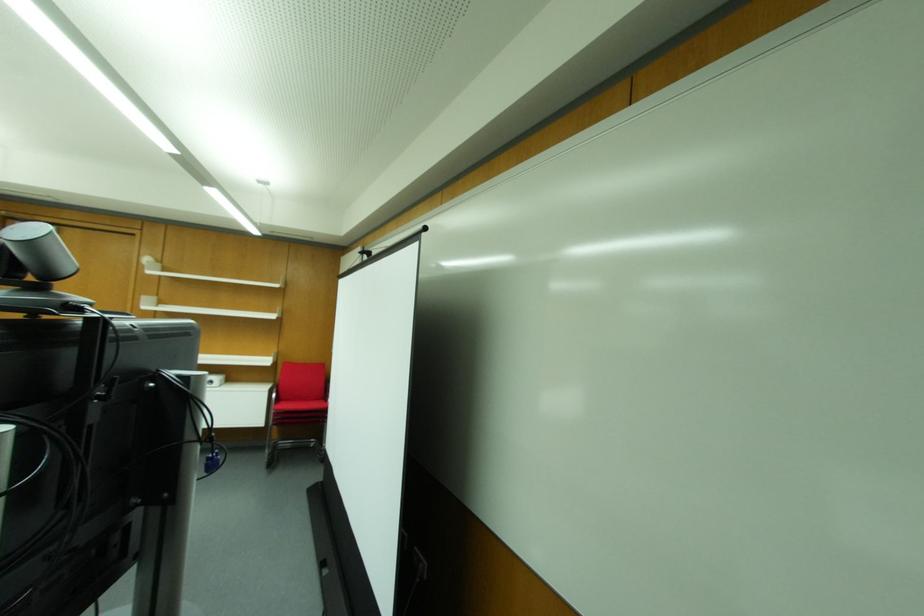
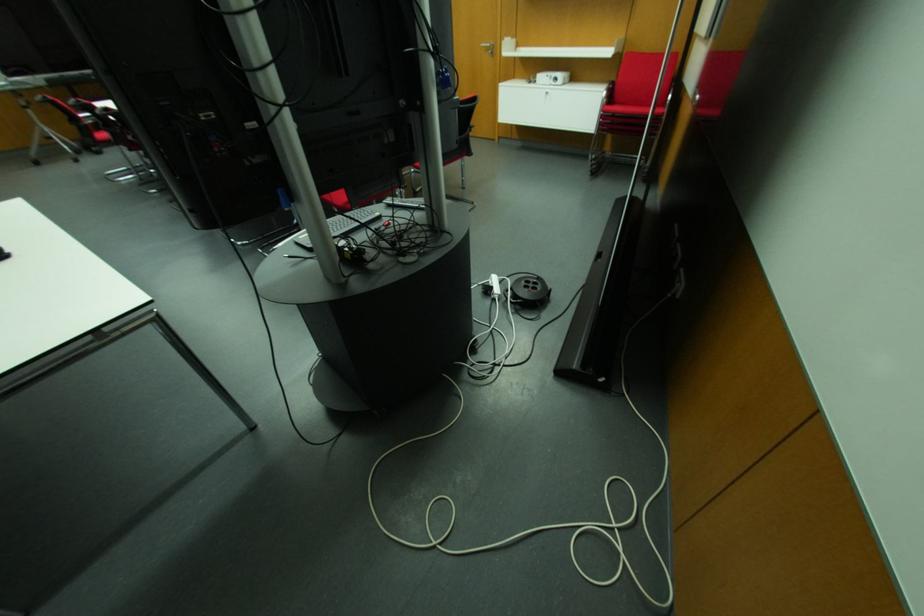
Consider the image. Based on the continuous images, in which direction is the camera rotating?

The camera's rotation is toward left-down.